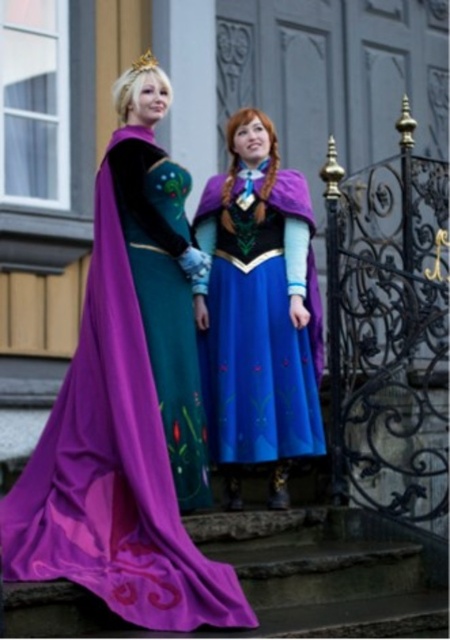
Between point (156, 541) and point (147, 68), which one is positioned behind?

The point (147, 68) is more distant.

Is the position of purple satin cape at center less distant than that of gold metallic crown at upper center?

Yes, it is in front of gold metallic crown at upper center.

What do you see at coordinates (113, 474) in the screenshot?
I see `purple satin cape at center` at bounding box center [113, 474].

You are a GUI agent. You are given a task and a screenshot of the screen. Output one action in this format:
    pyautogui.click(x=<x>, y=<y>)
    Task: Click on the purple satin cape at center
    This screenshot has width=450, height=640.
    Given the screenshot: What is the action you would take?
    pyautogui.click(x=113, y=474)

Is purple satin cape at center positioned in front of blue satin dress at center?

Yes, purple satin cape at center is in front of blue satin dress at center.

Does purple satin cape at center have a lesser width compared to blue satin dress at center?

Incorrect, purple satin cape at center's width is not less than blue satin dress at center's.

Is point (198, 604) farther from viewer compared to point (279, 224)?

No, (198, 604) is closer to viewer.

I want to click on purple satin cape at center, so click(x=113, y=474).

Between point (296, 387) and point (152, 65), which one is positioned in front?

Point (296, 387) is more forward.

Who is positioned more to the right, blue satin dress at center or gold metallic crown at upper center?

Positioned to the right is blue satin dress at center.

At what (x,y) coordinates should I click in order to perform the action: click on blue satin dress at center. Please return your answer as a coordinate pair (x, y). The image size is (450, 640). Looking at the image, I should click on (259, 310).

The image size is (450, 640). In order to click on blue satin dress at center in this screenshot , I will do `click(259, 310)`.